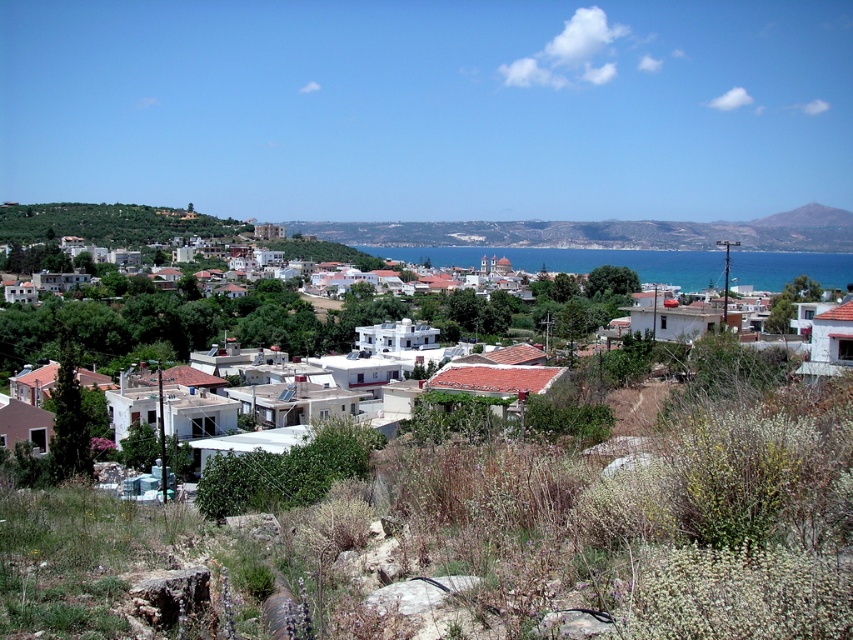
Is point (155, 337) positioned after point (672, 275)?

That is False.

Which is in front, point (254, 323) or point (436, 252)?

Point (254, 323) is in front.

The height and width of the screenshot is (640, 853). What do you see at coordinates (178, 323) in the screenshot? I see `white matte houses at center` at bounding box center [178, 323].

Where is `white matte houses at center`? The width and height of the screenshot is (853, 640). white matte houses at center is located at coordinates (178, 323).